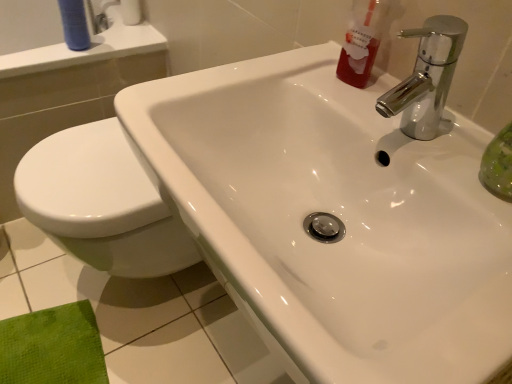
Locate an element on the screen. empty space that is in between blue matte tube at upper left and white paper towel at upper left is located at coordinates (111, 34).